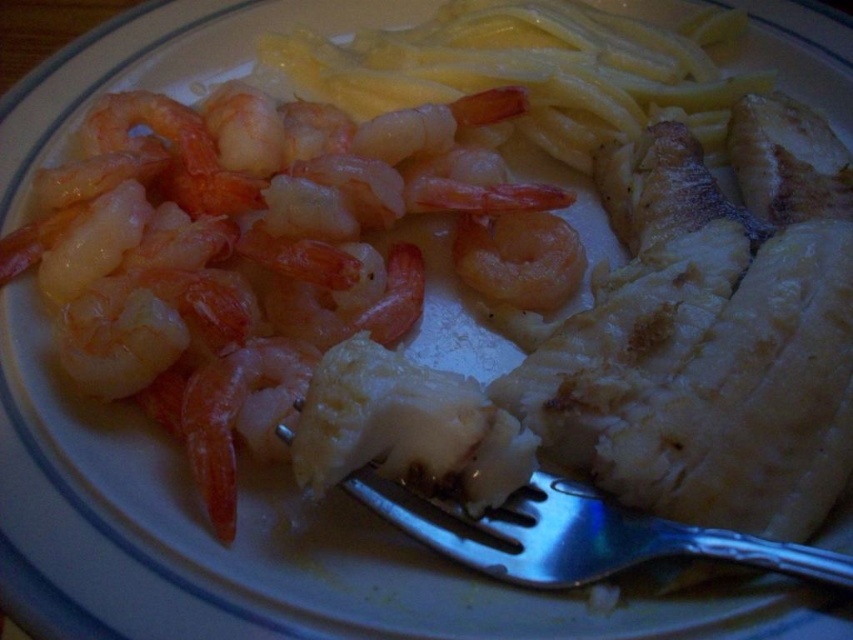
Question: Which object appears closest to the camera in this image?

Choices:
 (A) pink translucent shrimp at upper left
 (B) silver metallic fork at center

Answer: (B)

Question: Is pink translucent shrimp at upper left above silver metallic fork at center?

Choices:
 (A) yes
 (B) no

Answer: (A)

Question: Among these points, which one is nearest to the camera?

Choices:
 (A) (212, 397)
 (B) (527, 579)

Answer: (B)

Question: Can you confirm if pink translucent shrimp at upper left is positioned above silver metallic fork at center?

Choices:
 (A) no
 (B) yes

Answer: (B)

Question: Where is pink translucent shrimp at upper left located in relation to silver metallic fork at center in the image?

Choices:
 (A) right
 (B) left

Answer: (B)